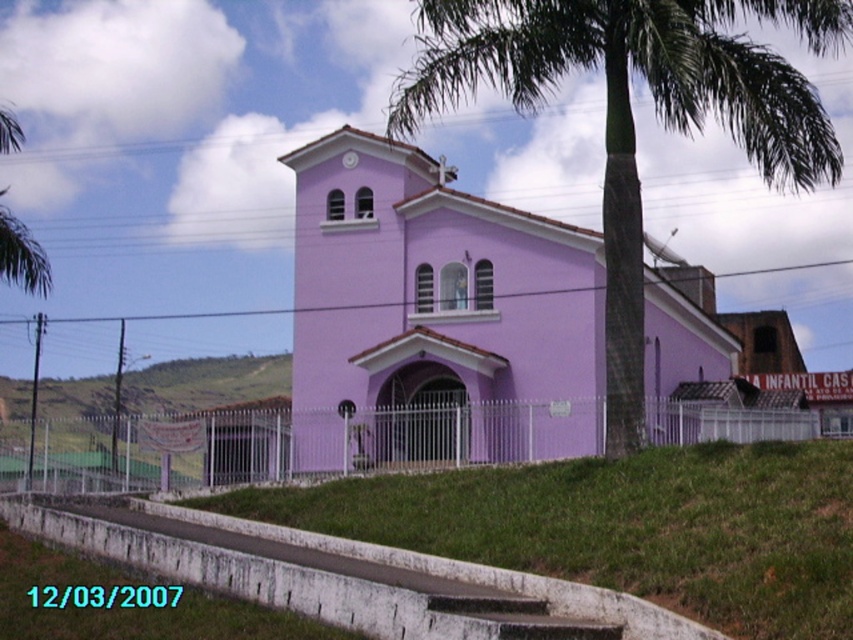
Question: Is green leafy palm tree at center thinner than green grassy hillside at lower left?

Choices:
 (A) no
 (B) yes

Answer: (A)

Question: Is matte purple church at center positioned at the back of green leafy palm tree at center?

Choices:
 (A) no
 (B) yes

Answer: (B)

Question: Among these points, which one is nearest to the camera?

Choices:
 (A) (436, 401)
 (B) (704, 108)
 (C) (277, 381)

Answer: (B)

Question: Which point is farther to the camera?

Choices:
 (A) matte purple church at center
 (B) green leafy palm tree at center

Answer: (A)

Question: Is matte purple church at center to the left of green leafy palm tree at center from the viewer's perspective?

Choices:
 (A) yes
 (B) no

Answer: (A)

Question: Among these points, which one is farthest from the camera?

Choices:
 (A) (840, 24)
 (B) (132, 381)

Answer: (B)